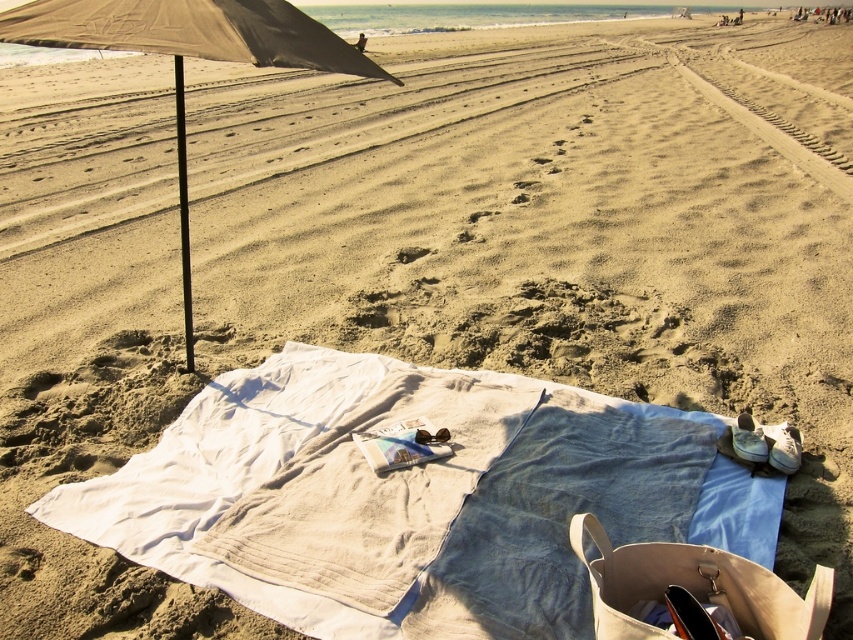
Is white cotton towel at center closer to the viewer compared to beige fabric umbrella at left?

No.

Between white cotton towel at center and beige fabric umbrella at left, which one is positioned lower?

Positioned lower is white cotton towel at center.

Which is in front, point (514, 518) or point (51, 10)?

Point (51, 10) is more forward.

Identify the location of white cotton towel at center. coord(457,515).

Looking at this image, can you confirm if beige fabric umbrella at left is shorter than brown sand footprint at center?

No.

Identify the location of beige fabric umbrella at left. (189, 54).

The height and width of the screenshot is (640, 853). What do you see at coordinates (189, 54) in the screenshot?
I see `beige fabric umbrella at left` at bounding box center [189, 54].

This screenshot has height=640, width=853. I want to click on beige fabric umbrella at left, so click(189, 54).

Does white cotton towel at center have a greater width compared to brown sand footprint at center?

Yes, white cotton towel at center is wider than brown sand footprint at center.

Is white cotton towel at center to the right of brown sand footprint at center from the viewer's perspective?

Correct, you'll find white cotton towel at center to the right of brown sand footprint at center.

Is point (421, 630) farther from camera compared to point (397, 256)?

No, (421, 630) is closer to viewer.

Find the location of a particular element. This screenshot has width=853, height=640. white cotton towel at center is located at coordinates (457, 515).